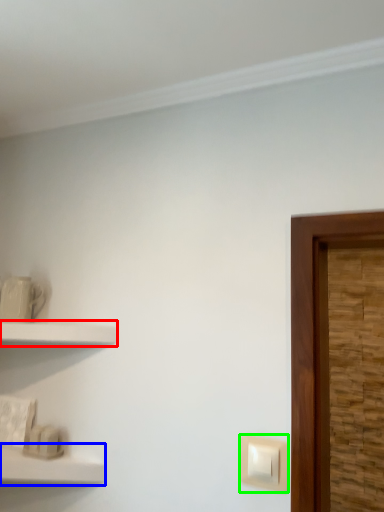
Question: Which object is the farthest from shelf (highlighted by a red box)? Choose among these: shelf (highlighted by a blue box) or light switch (highlighted by a green box).

Choices:
 (A) shelf
 (B) light switch

Answer: (B)